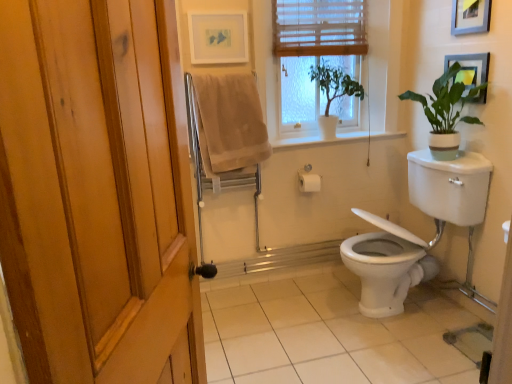
Question: Could you tell me if matte white picture frame at upper center, the 3th picture frame when ordered from right to left, is facing wooden blinds at upper center?

Choices:
 (A) yes
 (B) no

Answer: (B)

Question: Is matte white picture frame at upper center, which is the first picture frame from left to right, to the right of wooden blinds at upper center from the viewer's perspective?

Choices:
 (A) yes
 (B) no

Answer: (B)

Question: Can you confirm if matte white picture frame at upper center, the 3th picture frame when ordered from right to left, is positioned to the left of wooden blinds at upper center?

Choices:
 (A) no
 (B) yes

Answer: (B)

Question: Can you confirm if matte white picture frame at upper center, which is the first picture frame from left to right, is taller than wooden blinds at upper center?

Choices:
 (A) no
 (B) yes

Answer: (A)

Question: Can you confirm if matte white picture frame at upper center, the 3th picture frame when ordered from right to left, is thinner than wooden blinds at upper center?

Choices:
 (A) yes
 (B) no

Answer: (A)

Question: From the image's perspective, is green matte plant at upper right, which appears as the 1th houseplant when viewed from the right, above or below metallic silver picture frame at upper right, acting as the 1th picture frame starting from the right?

Choices:
 (A) below
 (B) above

Answer: (A)

Question: In terms of size, does green matte plant at upper right, which appears as the 1th houseplant when viewed from the right, appear bigger or smaller than metallic silver picture frame at upper right, acting as the 1th picture frame starting from the right?

Choices:
 (A) small
 (B) big

Answer: (B)

Question: Choose the correct answer: Is green matte plant at upper right, which appears as the 1th houseplant when viewed from the right, inside metallic silver picture frame at upper right, which is the third picture frame in left-to-right order, or outside it?

Choices:
 (A) outside
 (B) inside

Answer: (A)

Question: From a real-world perspective, relative to metallic silver picture frame at upper right, which is the third picture frame in left-to-right order, is green matte plant at upper right, the second houseplant when ordered from left to right, vertically above or below?

Choices:
 (A) below
 (B) above

Answer: (A)

Question: Based on their sizes in the image, would you say wooden blinds at upper center is bigger or smaller than wooden blinds at upper center?

Choices:
 (A) small
 (B) big

Answer: (B)

Question: Is wooden blinds at upper center in front of or behind wooden blinds at upper center in the image?

Choices:
 (A) front
 (B) behind

Answer: (A)

Question: From a real-world perspective, is wooden blinds at upper center physically located above or below wooden blinds at upper center?

Choices:
 (A) above
 (B) below

Answer: (B)

Question: Looking at their shapes, would you say wooden blinds at upper center is wider or thinner than wooden blinds at upper center?

Choices:
 (A) wide
 (B) thin

Answer: (A)

Question: From the image's perspective, is beige cotton towel at upper center positioned above or below white tile at lower center?

Choices:
 (A) below
 (B) above

Answer: (B)

Question: In terms of size, does beige cotton towel at upper center appear bigger or smaller than white tile at lower center?

Choices:
 (A) big
 (B) small

Answer: (B)